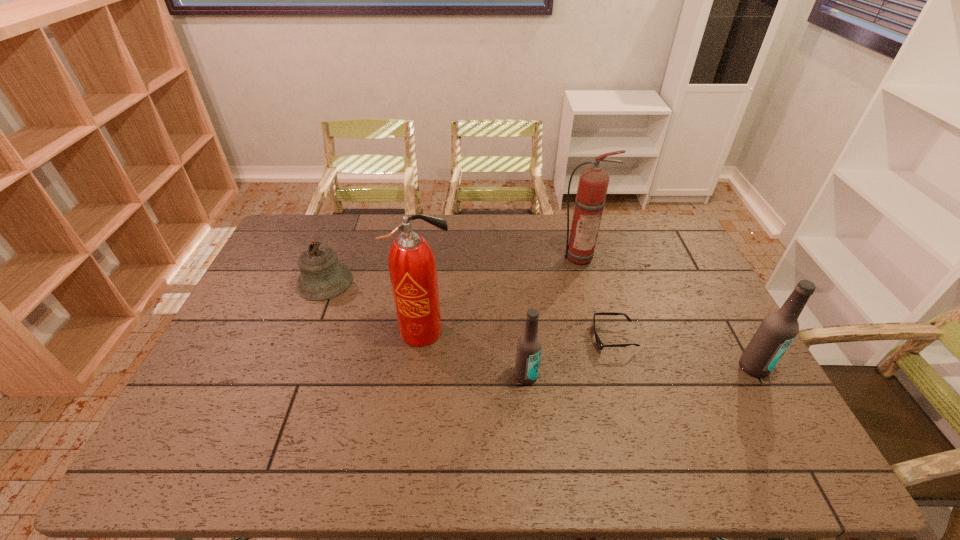
The height and width of the screenshot is (540, 960). In order to click on vacant position located 0.110m on the side of the third tallest object with the label in this screenshot , I will do `click(781, 416)`.

The height and width of the screenshot is (540, 960). Find the location of `blank area located on the side of the right fire extinguisher with the label and nozzle`. blank area located on the side of the right fire extinguisher with the label and nozzle is located at coordinates (586, 280).

The width and height of the screenshot is (960, 540). What are the coordinates of `free region located 0.050m on the front-facing side of the sunglasses` in the screenshot? It's located at (575, 338).

Identify the location of vacant space located on the front-facing side of the sunglasses. The width and height of the screenshot is (960, 540). (467, 338).

Locate an element on the screen. free region located 0.340m on the front-facing side of the sunglasses is located at coordinates (476, 338).

Where is `free point located on the back of the second object from left to right`? This screenshot has width=960, height=540. free point located on the back of the second object from left to right is located at coordinates (430, 283).

Locate an element on the screen. vacant space located on the front of the bell is located at coordinates (287, 380).

Where is `object situated at the far edge`? This screenshot has width=960, height=540. object situated at the far edge is located at coordinates (593, 183).

Identify the location of object at the left edge. (322, 277).

Identify the location of object positioned at the right edge. (778, 329).